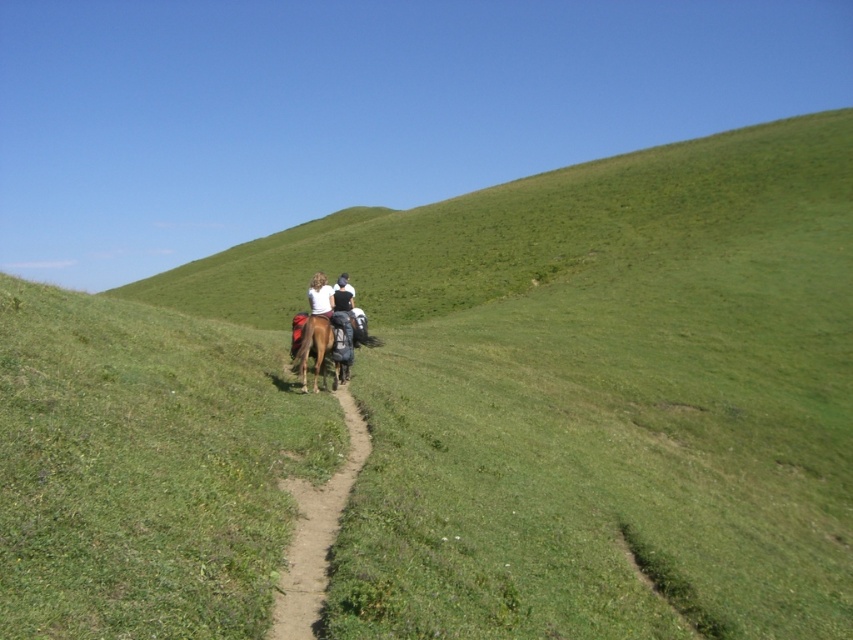
Question: Does brown dirt path at center appear under brown glossy horse at center?

Choices:
 (A) no
 (B) yes

Answer: (B)

Question: Which of the following is the farthest from the observer?

Choices:
 (A) (310, 324)
 (B) (310, 497)

Answer: (A)

Question: Which point appears farthest from the camera in this image?

Choices:
 (A) (276, 605)
 (B) (303, 380)

Answer: (B)

Question: Does brown dirt path at center appear over brown glossy horse at center?

Choices:
 (A) yes
 (B) no

Answer: (B)

Question: Observing the image, what is the correct spatial positioning of brown dirt path at center in reference to brown glossy horse at center?

Choices:
 (A) right
 (B) left

Answer: (A)